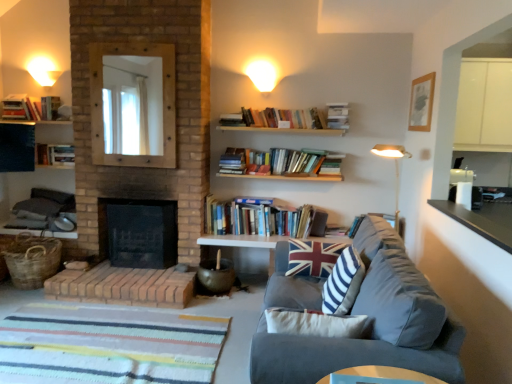
Question: Is velvet gray couch at lower right to the left of union jack fabric pillow at center, the 2th pillow positioned from the front, from the viewer's perspective?

Choices:
 (A) yes
 (B) no

Answer: (B)

Question: From the image's perspective, would you say velvet gray couch at lower right is positioned over union jack fabric pillow at center, the 2th pillow positioned from the front?

Choices:
 (A) yes
 (B) no

Answer: (B)

Question: Is velvet gray couch at lower right positioned with its back to union jack fabric pillow at center, the 2th pillow positioned from the front?

Choices:
 (A) yes
 (B) no

Answer: (A)

Question: Considering the relative sizes of velvet gray couch at lower right and union jack fabric pillow at center, the 2th pillow positioned from the front, in the image provided, is velvet gray couch at lower right wider than union jack fabric pillow at center, the 2th pillow positioned from the front,?

Choices:
 (A) no
 (B) yes

Answer: (B)

Question: Are velvet gray couch at lower right and union jack fabric pillow at center, acting as the 1th pillow starting from the back, beside each other?

Choices:
 (A) yes
 (B) no

Answer: (B)

Question: Would you say hardcover book at upper left, which is the 4th book from bottom to top, is to the left or to the right of white matte wall sconce at upper left, the 1th lighting positioned from the left, in the picture?

Choices:
 (A) left
 (B) right

Answer: (A)

Question: Relative to white matte wall sconce at upper left, the 1th lighting positioned from the left, is hardcover book at upper left, the 5th book viewed from the right, in front or behind?

Choices:
 (A) front
 (B) behind

Answer: (A)

Question: From their relative heights in the image, would you say hardcover book at upper left, marked as the 1th book in a left-to-right arrangement, is taller or shorter than white matte wall sconce at upper left, the 1th lighting positioned from the left?

Choices:
 (A) tall
 (B) short

Answer: (A)

Question: Which is correct: hardcover book at upper left, the 5th book viewed from the right, is inside white matte wall sconce at upper left, which appears as the 2th lighting when viewed from the front, or outside of it?

Choices:
 (A) inside
 (B) outside

Answer: (B)

Question: In terms of height, does wooden mirror at upper left look taller or shorter compared to hardcover books at left, which is the second book from bottom to top?

Choices:
 (A) short
 (B) tall

Answer: (B)

Question: From the image's perspective, relative to hardcover books at left, which is counted as the second book, starting from the left, is wooden mirror at upper left above or below?

Choices:
 (A) above
 (B) below

Answer: (A)

Question: From a real-world perspective, is wooden mirror at upper left above or below hardcover books at left, which is the second book from bottom to top?

Choices:
 (A) above
 (B) below

Answer: (A)

Question: Is point (167, 114) positioned closer to the camera than point (71, 147)?

Choices:
 (A) farther
 (B) closer

Answer: (B)

Question: Is point (330, 125) closer or farther from the camera than point (327, 266)?

Choices:
 (A) farther
 (B) closer

Answer: (A)

Question: Is hardcover book at upper center, the third book from the bottom, inside or outside of union jack fabric pillow at center, acting as the 1th pillow starting from the back?

Choices:
 (A) inside
 (B) outside

Answer: (B)